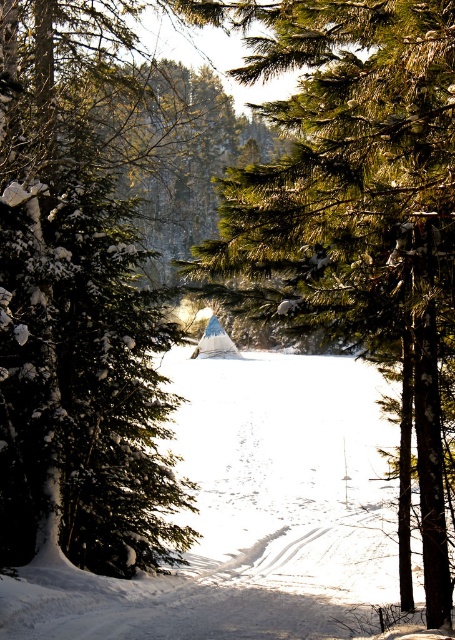
You are driving a snowmobile that is 2 meters wide. You want to pass through the path between the green textured pine tree at center and the white powdery snow at center. Can your snowmobile fit through the path? Please explain your reasoning.

The green textured pine tree at center is narrower than the white powdery snow at center. However, the question mentions the snowmobile needs to pass through the path between the two objects. Since the snowmobile is 2 meters wide, and the path width isn not specified, we cannot determine if it will fit. Please provide more information about the path width.

Consider the image. You are driving a car that is 2 meters wide. You see the green matte evergreen tree at left and the white powdery snow at center. Can your car pass through the space between them?

The green matte evergreen tree at left has a lesser width compared to white powdery snow at center. Since the tree is narrower than the snow area, the 2 meter wide car should be able to pass through the space between them as long as there is enough clearance on both sides.

You are standing at the center of a snowy path framed by tall evergreen trees. You notice a point marked at coordinates (75, 308). Which object from the scene does this point belong to?

The point at (75, 308) is on the green matte evergreen tree at left.